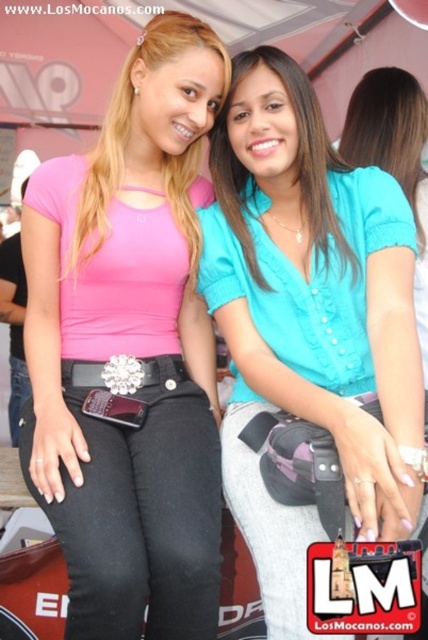
Question: Estimate the real-world distances between objects in this image. Which object is closer to the matte teal blouse at center?

Choices:
 (A) silver metallic belt at center
 (B) matte pink shirt at center

Answer: (B)

Question: Which point is closer to the camera?

Choices:
 (A) (50, 458)
 (B) (401, 172)

Answer: (A)

Question: Is matte pink shirt at center positioned at the back of smooth teal blouse at center?

Choices:
 (A) yes
 (B) no

Answer: (B)

Question: Does matte pink shirt at center come behind silver metallic belt at center?

Choices:
 (A) no
 (B) yes

Answer: (A)

Question: Among these objects, which one is nearest to the camera?

Choices:
 (A) matte blue shirt at center
 (B) matte teal blouse at center
 (C) smooth teal blouse at center
 (D) silver metallic belt at center

Answer: (A)

Question: In this image, where is matte blue shirt at center located relative to matte teal blouse at center?

Choices:
 (A) right
 (B) left

Answer: (A)